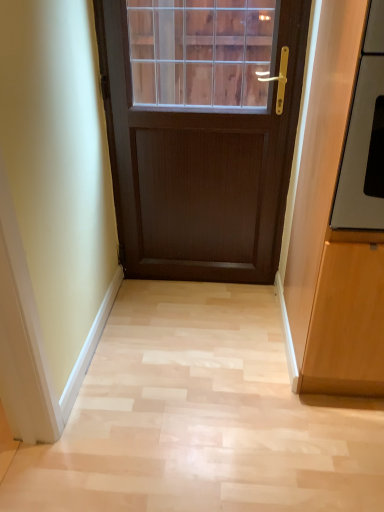
This screenshot has height=512, width=384. What are the coordinates of `blank area to the left of matte wood cabinet at right` in the screenshot? It's located at (229, 377).